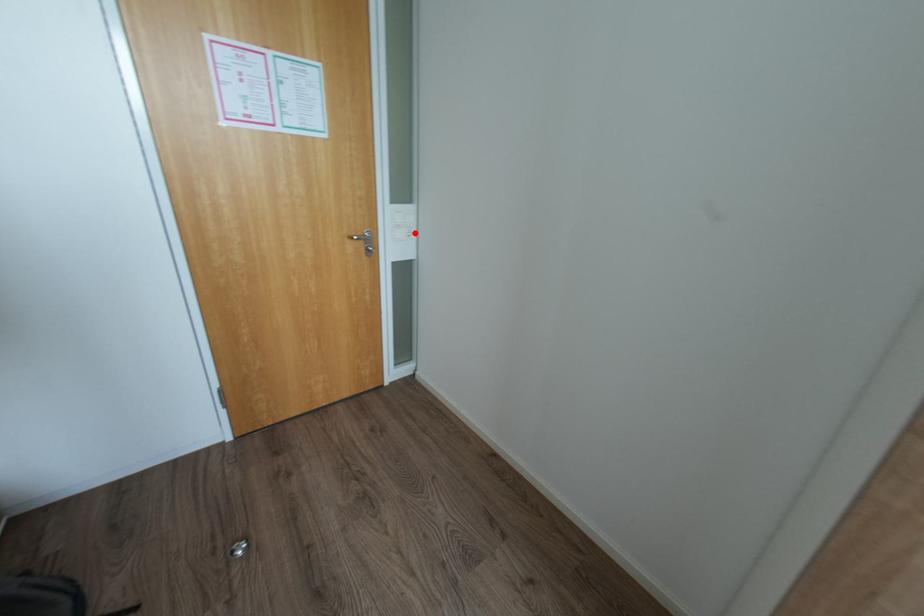
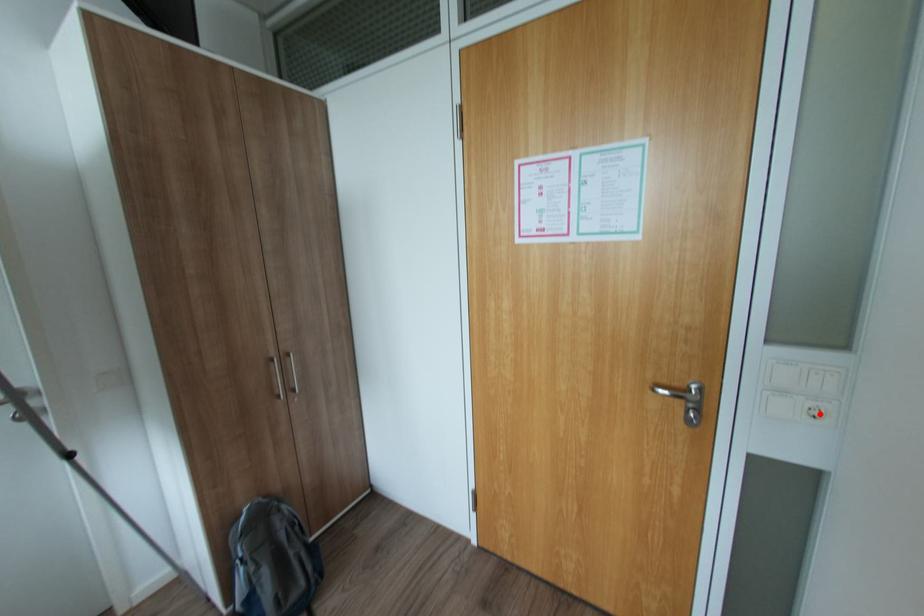
I am providing you with two images of the same scene from different viewpoints. A red point is marked on the first image and another point is marked on the second image. Are the points marked in image1 and image2 representing the same 3D position?

Yes